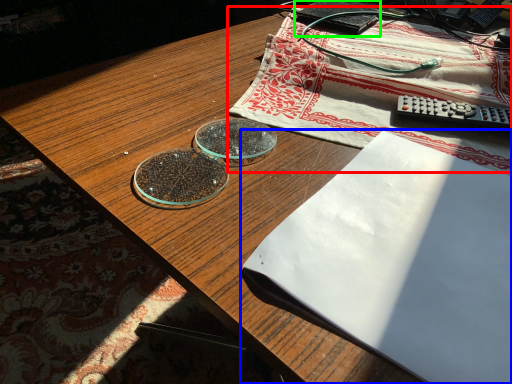
Question: Which is nearer to the tablecloth (highlighted by a red box)? notebook (highlighted by a blue box) or paperback book (highlighted by a green box).

Choices:
 (A) notebook
 (B) paperback book

Answer: (B)